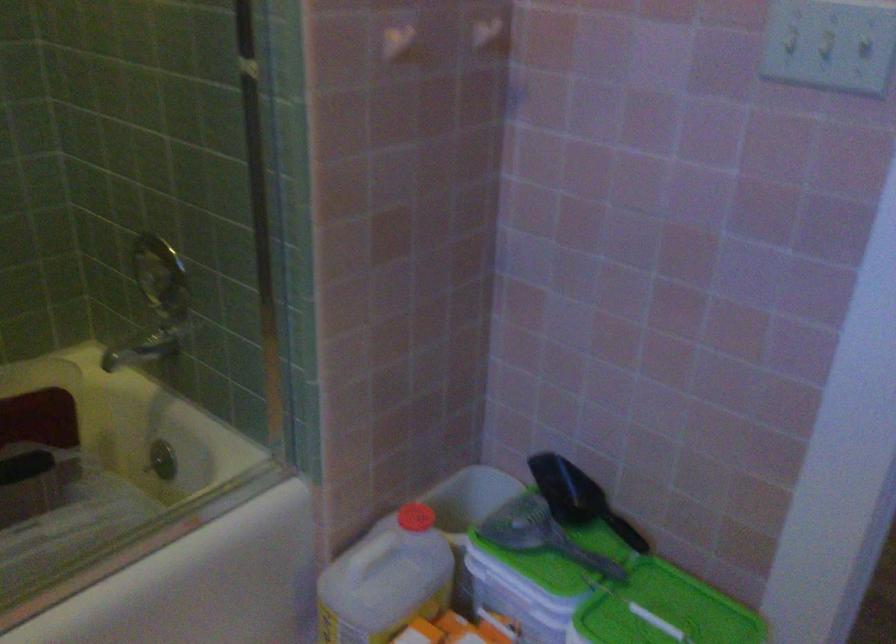
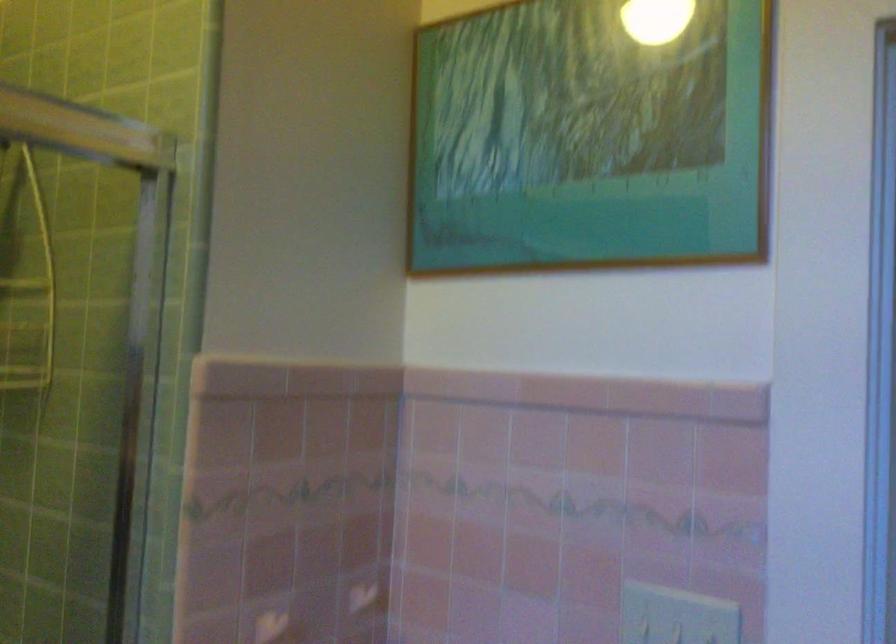
What movement of the cameraman would produce the second image?

The movement direction of the cameraman is right, backward.